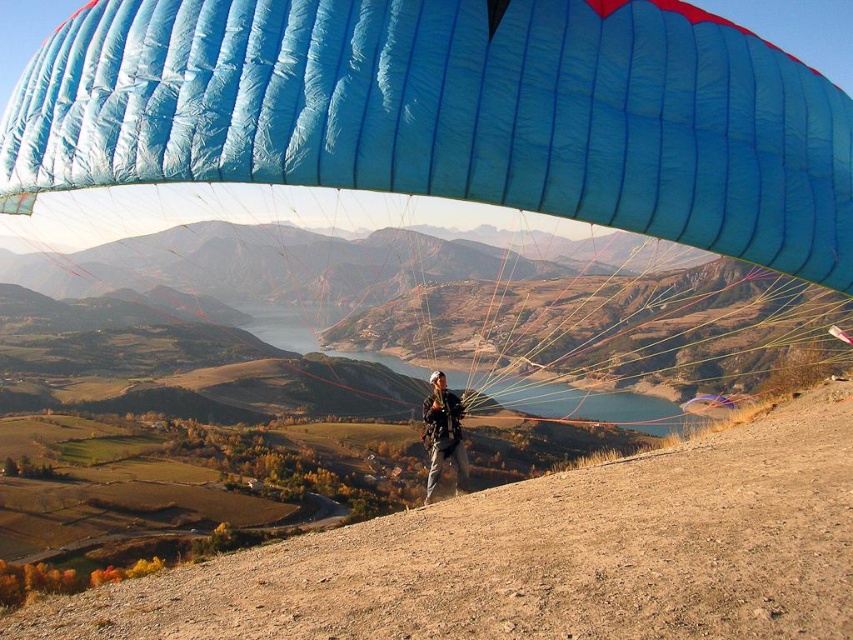
Question: Is blue fabric parachute at center bigger than matte black helmet at center?

Choices:
 (A) yes
 (B) no

Answer: (A)

Question: Which object is closer to the camera taking this photo?

Choices:
 (A) matte black helmet at center
 (B) blue fabric parachute at center

Answer: (B)

Question: Does blue fabric parachute at center appear under matte black helmet at center?

Choices:
 (A) no
 (B) yes

Answer: (B)

Question: Which object is farther from the camera taking this photo?

Choices:
 (A) matte black helmet at center
 (B) blue fabric parachute at center

Answer: (A)

Question: Can you confirm if blue fabric parachute at center is wider than matte black helmet at center?

Choices:
 (A) yes
 (B) no

Answer: (A)